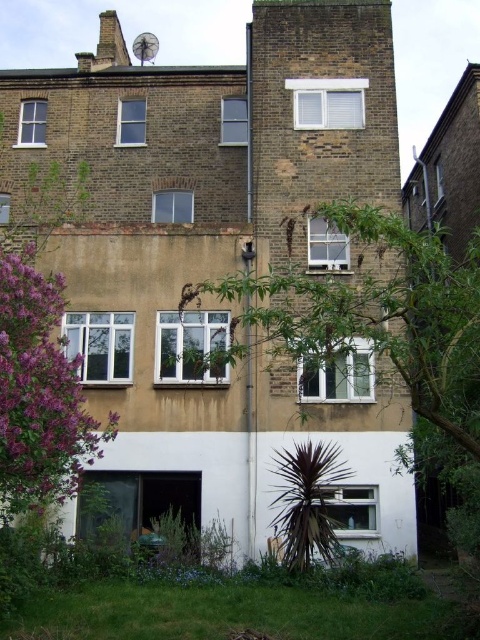
You are a gardener planning to plant a new tree in the yard of the residential building. You want to ensure that the new tree won not block the satellite dish on the roof. Which existing tree, the green leafy tree at center or the purple leafy tree at lower left, is more likely to have branches that could reach the satellite dish?

The green leafy tree at center might be wider than purple leafy tree at lower left, so it is more likely to have branches that could reach the satellite dish.